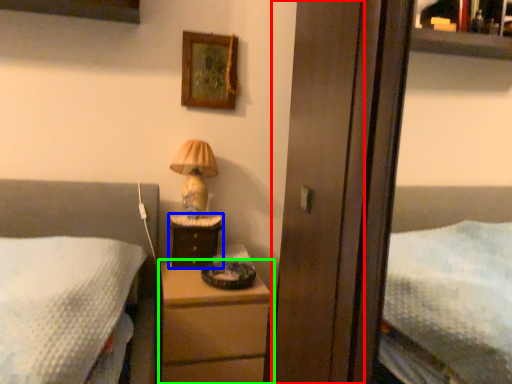
Question: Based on their relative distances, which object is farther from screen door (highlighted by a red box)? Choose from nightstand (highlighted by a blue box) and chest of drawers (highlighted by a green box).

Choices:
 (A) nightstand
 (B) chest of drawers

Answer: (A)